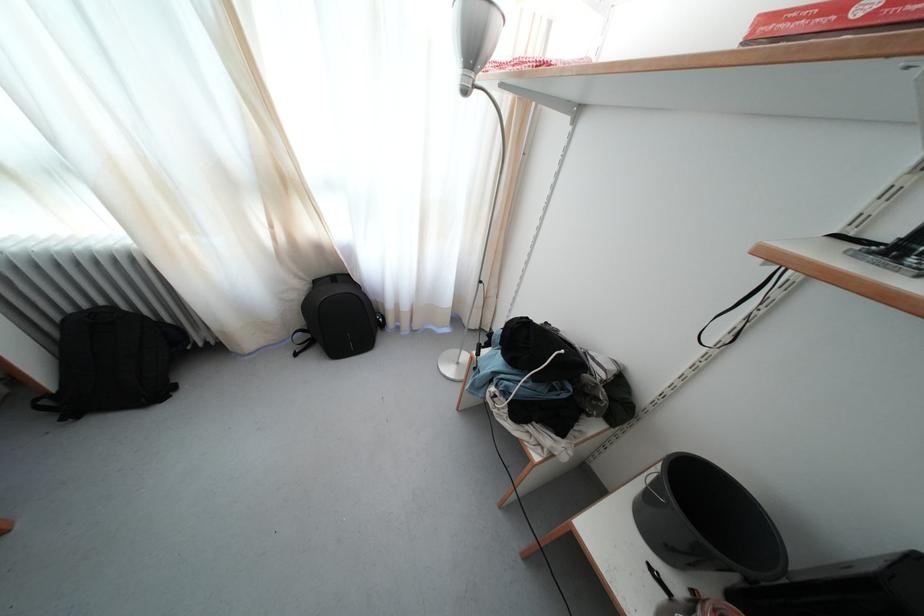
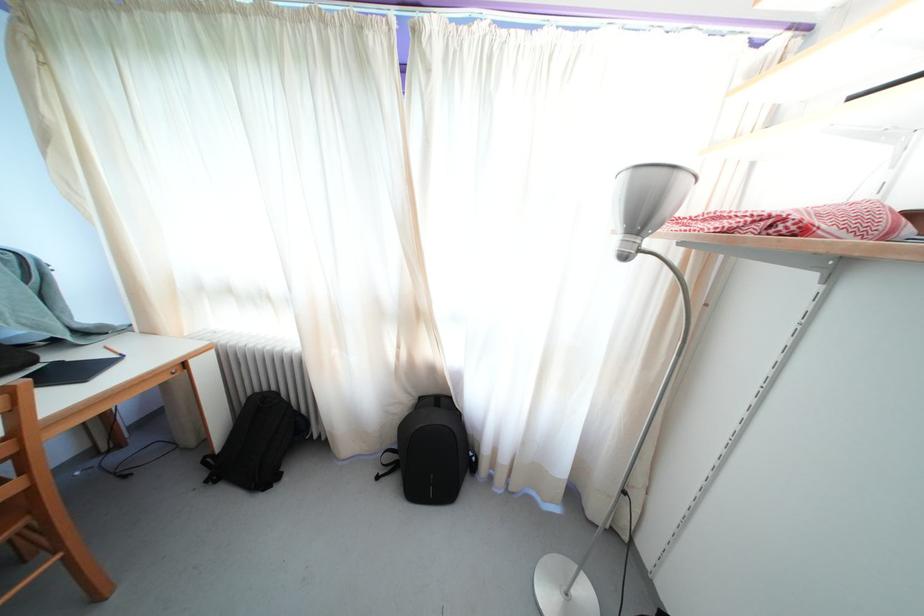
In the second image, find the point that corresponds to [288,188] in the first image.

(421, 321)